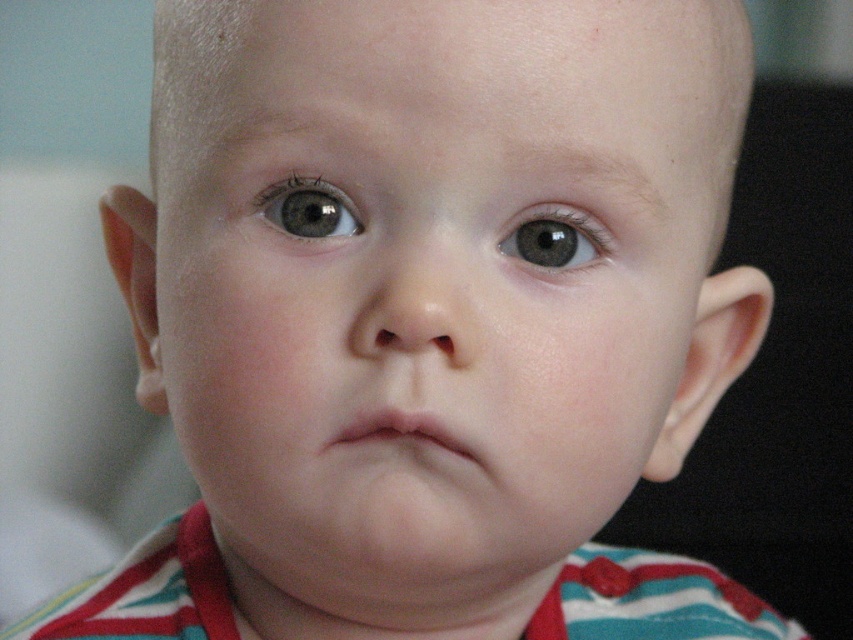
Based on the photo, A photographer wants to capture a closeup of a baby with a focus on the face and eyes. They have a camera that can only focus on objects within a 2.5 inches range. Given the smooth skin face at center and the gray matte eye at center, will the camera be able to keep both in focus simultaneously?

The smooth skin face at center and the gray matte eye at center are 2.58 inches apart. Since the distance between them exceeds the camera focus range of 2.5 inches, the camera cannot keep both in focus simultaneously.

You are a photographer adjusting lighting for a baby portrait. The baby has a smooth skin face at center and a matte gray eye at upper center. You need to ensure the lighting is even across both areas. Given their distance apart, is the 6.70 centimeter gap between them significant enough to require separate lighting adjustments?

The smooth skin face at center is 6.70 centimeters away from the matte gray eye at upper center. This distance may require separate lighting adjustments to ensure even illumination between the two areas.